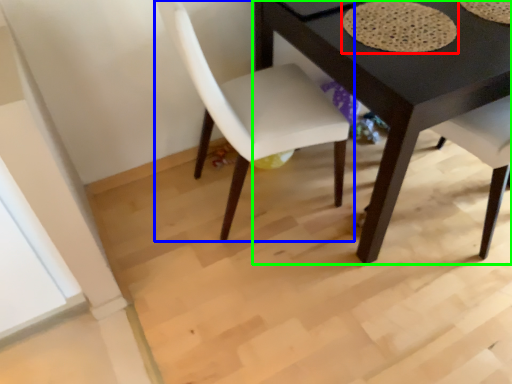
Question: Which object is the closest to the mat (highlighted by a red box)? Choose among these: chair (highlighted by a blue box) or table (highlighted by a green box).

Choices:
 (A) chair
 (B) table

Answer: (B)